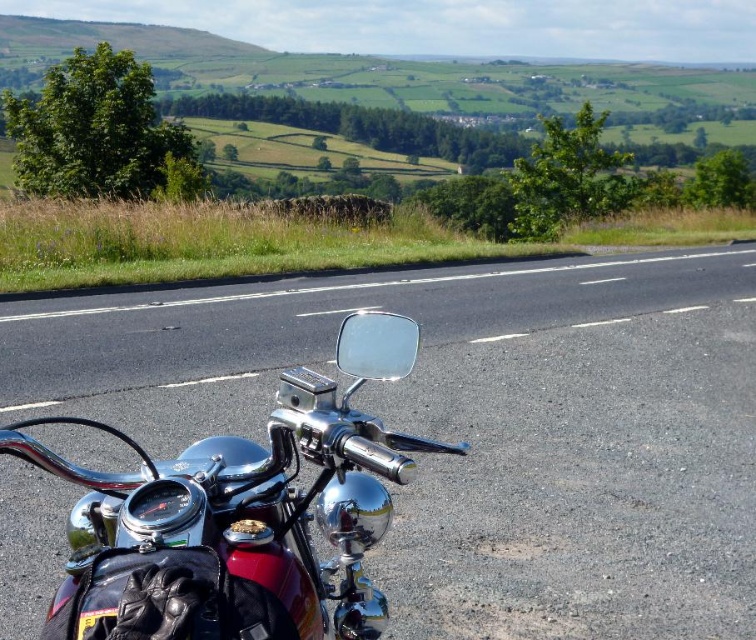
You are a motorcyclist preparing to ride down the black asphalt road at center. You notice the green grass at upper left in the distance. Which path is shorter for your journey?

The black asphalt road at center is shorter than the green grass at upper left, so the black asphalt road at center is the shorter path for your journey.